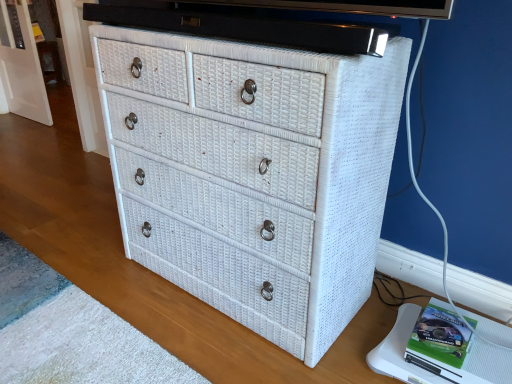
From the picture: Measure the distance between point (399, 110) and camera.

The depth of point (399, 110) is 3.80 feet.

The width and height of the screenshot is (512, 384). I want to click on white wicker chest of drawers at center, so click(253, 173).

Image resolution: width=512 pixels, height=384 pixels. What do you see at coordinates (253, 173) in the screenshot?
I see `white wicker chest of drawers at center` at bounding box center [253, 173].

Find the location of a particular element. white wicker chest of drawers at center is located at coordinates pos(253,173).